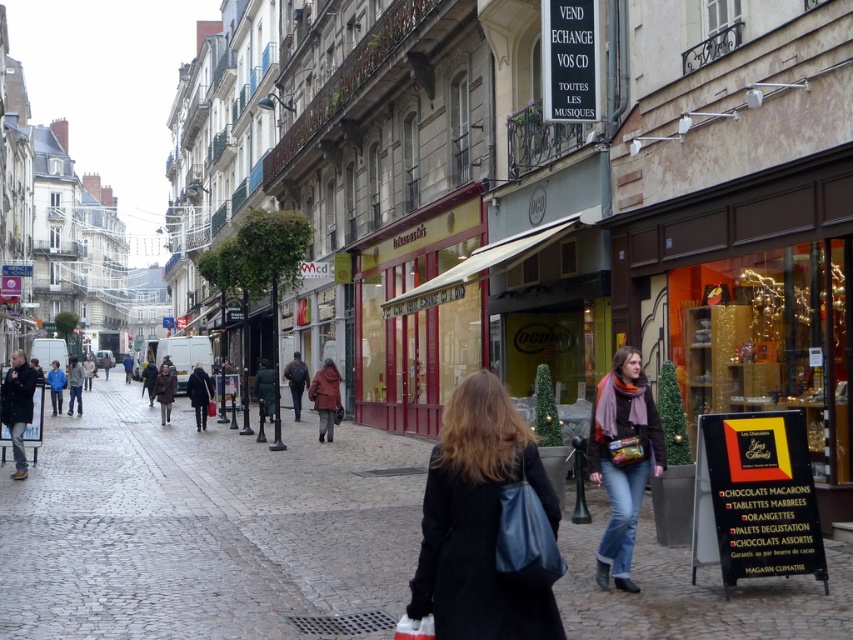
How distant is denim jeans at center from black leather coat at center?

A distance of 11.03 feet exists between denim jeans at center and black leather coat at center.

Looking at this image, which of these two, denim jeans at center or black leather coat at center, stands shorter?

Standing shorter between the two is black leather coat at center.

What do you see at coordinates (621, 461) in the screenshot?
I see `denim jeans at center` at bounding box center [621, 461].

You are a GUI agent. You are given a task and a screenshot of the screen. Output one action in this format:
    pyautogui.click(x=<x>, y=<y>)
    Task: Click on the denim jeans at center
    
    Given the screenshot: What is the action you would take?
    pyautogui.click(x=621, y=461)

Looking at this image, is cobblestone pavement at center shorter than black leather coat at center?

No.

Which is more to the left, cobblestone pavement at center or black leather coat at center?

From the viewer's perspective, cobblestone pavement at center appears more on the left side.

Is point (173, 458) positioned before point (550, 618)?

That is False.

Image resolution: width=853 pixels, height=640 pixels. Find the location of `cobblestone pavement at center`. cobblestone pavement at center is located at coordinates (206, 528).

Can you confirm if cobblestone pavement at center is bigger than denim jeans at center?

Yes.

Can you confirm if cobblestone pavement at center is positioned below denim jeans at center?

Indeed, cobblestone pavement at center is positioned under denim jeans at center.

Describe the element at coordinates (206, 528) in the screenshot. I see `cobblestone pavement at center` at that location.

At what (x,y) coordinates should I click in order to perform the action: click on cobblestone pavement at center. Please return your answer as a coordinate pair (x, y). The width and height of the screenshot is (853, 640). Looking at the image, I should click on (206, 528).